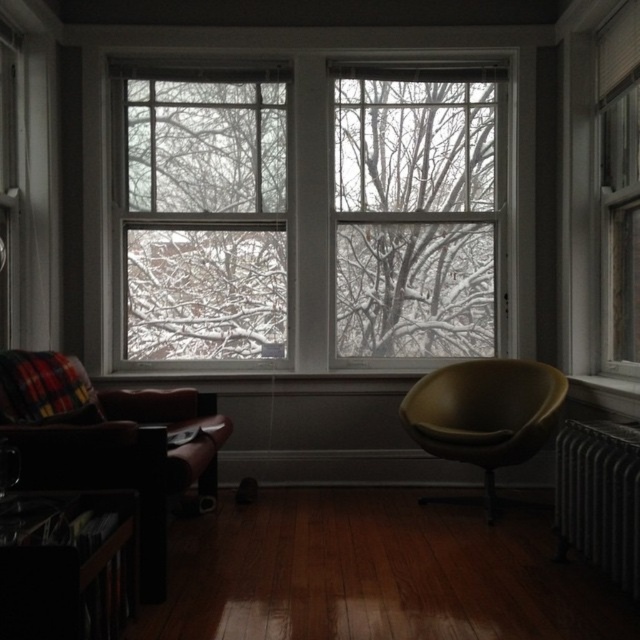
Is point (616, 132) behind point (563, 456)?

That is True.

Describe the element at coordinates (620, 188) in the screenshot. I see `clear glass window at upper right` at that location.

Which is in front, point (611, 90) or point (595, 525)?

Positioned in front is point (595, 525).

Locate an element on the screen. clear glass window at upper right is located at coordinates (620, 188).

Between leather armchair at left and wooden bookshelf at lower left, which one is positioned lower?

wooden bookshelf at lower left is lower down.

Does leather armchair at left have a greater width compared to wooden bookshelf at lower left?

Indeed, leather armchair at left has a greater width compared to wooden bookshelf at lower left.

Is point (80, 376) positioned in front of point (106, 541)?

No, (80, 376) is behind (106, 541).

Where is `leather armchair at left`? The height and width of the screenshot is (640, 640). leather armchair at left is located at coordinates (108, 444).

In the scene shown: Who is shorter, wooden bookshelf at lower left or clear glass window at upper right?

Standing shorter between the two is wooden bookshelf at lower left.

Locate an element on the screen. This screenshot has width=640, height=640. wooden bookshelf at lower left is located at coordinates (67, 564).

Where is `wooden bookshelf at lower left`? Image resolution: width=640 pixels, height=640 pixels. wooden bookshelf at lower left is located at coordinates (67, 564).